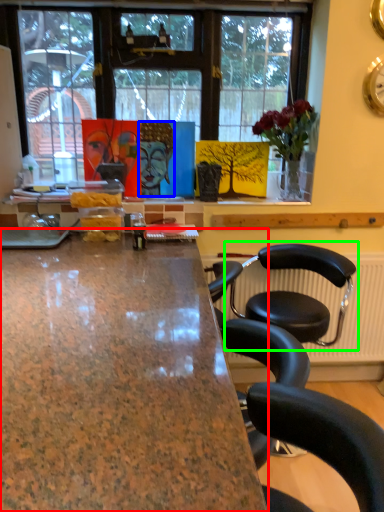
Question: Which object is positioned closest to desk (highlighted by a red box)? Select from person (highlighted by a blue box) and chair (highlighted by a green box).

Choices:
 (A) person
 (B) chair

Answer: (B)